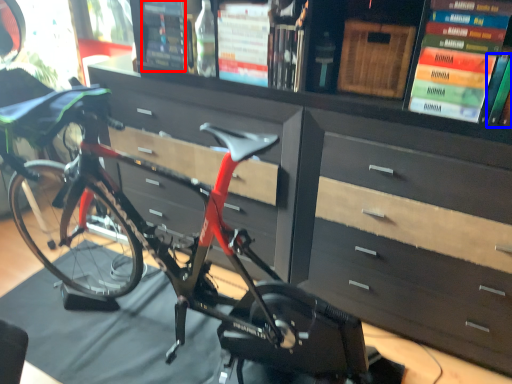
Question: Which of the following is the farthest to the observer, book (highlighted by a red box) or book (highlighted by a blue box)?

Choices:
 (A) book
 (B) book

Answer: (A)